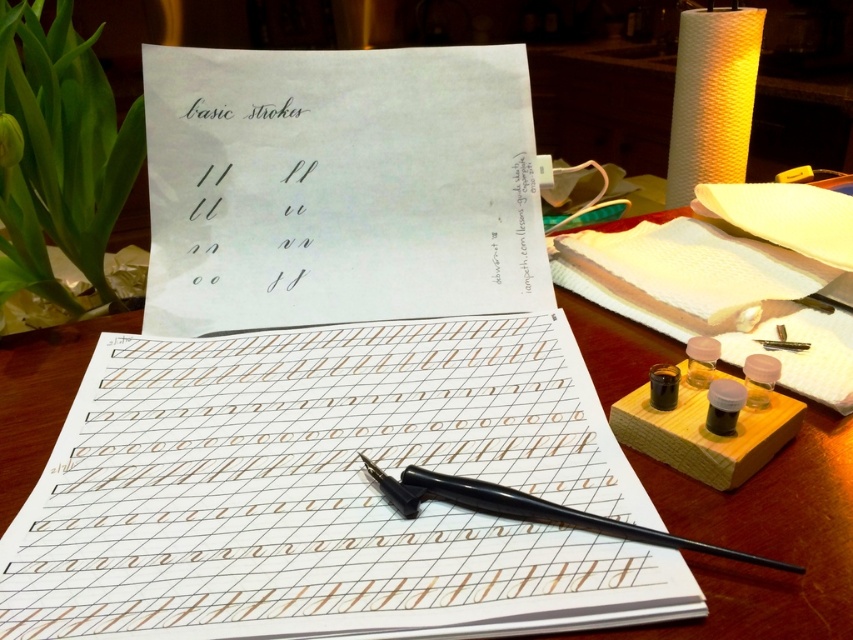
You are a calligraphy student who wants to choose an item to use for writing. You need to pick the taller object between the black smooth pen at center and the black glossy ink at lower right. Which one should you choose?

The black smooth pen at center is taller than the black glossy ink at lower right, so you should choose the black smooth pen at center.

You are a calligraphy student who wants to start practicing on the brown paper notebook at center. However, you notice the translucent plastic ink bottles at lower right are in the way. Can you move the bottles to make space for the notebook?

The brown paper notebook at center is located below the translucent plastic ink bottles at lower right, so moving the bottles upwards would create space for the notebook.

In the scene shown: You are a calligraphy student who wants to choose an ink container for a detailed project. Considering the size and position of the translucent glass ink bottles at lower right and the translucent amber glass inkwell at center right, which one would you recommend using and why?

The translucent glass ink bottles at lower right are bigger than the translucent amber glass inkwell at center right, so the translucent glass ink bottles at lower right would be better for a detailed project because they can hold more ink and are easier to handle due to their larger size.